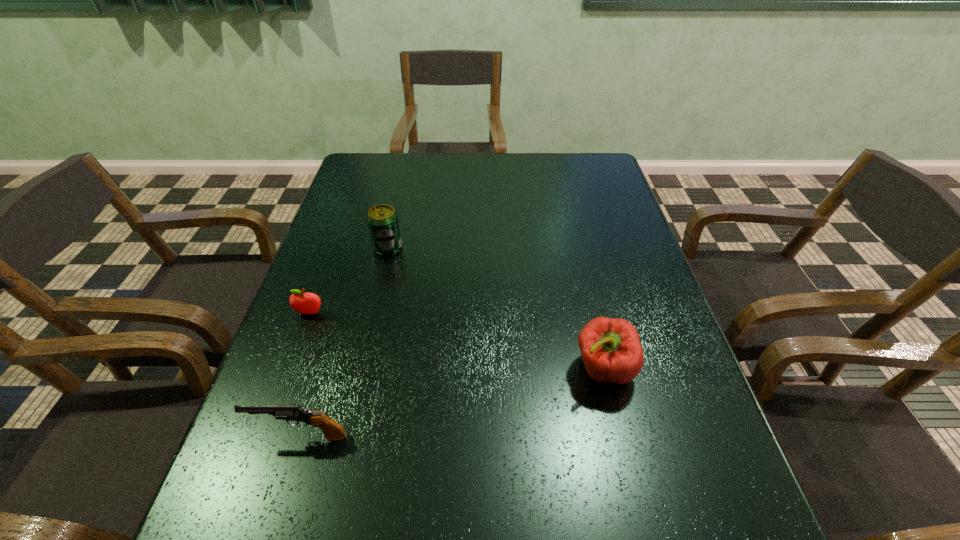
The image size is (960, 540). I want to click on object identified as the third closest to the rightmost object, so click(304, 303).

Locate an element on the screen. free region that satisfies the following two spatial constraints: 1. on the front side of the rightmost object; 2. on the right side of the second farthest object is located at coordinates (289, 369).

This screenshot has width=960, height=540. I want to click on vacant space that satisfies the following two spatial constraints: 1. on the back side of the third nearest object; 2. on the left side of the farthest object, so click(x=334, y=248).

I want to click on free region that satisfies the following two spatial constraints: 1. along the barrel of the beer can; 2. on the left side of the nearest object, so click(x=358, y=248).

In order to click on vacant space that satisfies the following two spatial constraints: 1. on the back side of the farthest object; 2. on the left side of the apple in this screenshot , I will do `click(334, 248)`.

I want to click on free location that satisfies the following two spatial constraints: 1. along the barrel of the nearest object; 2. on the back side of the farthest object, so click(358, 248).

Find the location of a particular element. vacant area in the image that satisfies the following two spatial constraints: 1. on the back side of the beer can; 2. on the right side of the second farthest object is located at coordinates (334, 248).

The width and height of the screenshot is (960, 540). What are the coordinates of `free point that satisfies the following two spatial constraints: 1. along the barrel of the nearest object; 2. on the front side of the shortest object` in the screenshot? It's located at [338, 313].

Locate an element on the screen. This screenshot has height=540, width=960. vacant region that satisfies the following two spatial constraints: 1. along the barrel of the nearest object; 2. on the left side of the second nearest object is located at coordinates [x=321, y=369].

Locate an element on the screen. The image size is (960, 540). vacant area in the image that satisfies the following two spatial constraints: 1. along the barrel of the nearest object; 2. on the left side of the farthest object is located at coordinates (358, 248).